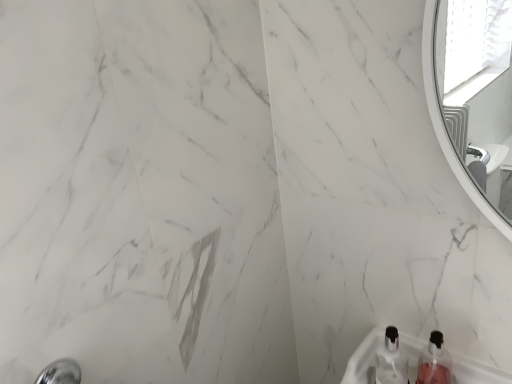
Question: Should I look upward or downward to see pink translucent bottle at lower right, the second bottle when ordered from left to right?

Choices:
 (A) up
 (B) down

Answer: (B)

Question: From the image's perspective, is pink translucent bottle at lower right, the first bottle viewed from the right, located beneath clear plastic bottle at lower center, acting as the 2th bottle starting from the right?

Choices:
 (A) no
 (B) yes

Answer: (B)

Question: Is pink translucent bottle at lower right, the second bottle when ordered from left to right, facing towards clear plastic bottle at lower center, which is the first bottle in left-to-right order?

Choices:
 (A) no
 (B) yes

Answer: (A)

Question: Can you confirm if pink translucent bottle at lower right, the second bottle when ordered from left to right, is shorter than clear plastic bottle at lower center, acting as the 2th bottle starting from the right?

Choices:
 (A) yes
 (B) no

Answer: (A)

Question: Is pink translucent bottle at lower right, the second bottle when ordered from left to right, wider than clear plastic bottle at lower center, acting as the 2th bottle starting from the right?

Choices:
 (A) no
 (B) yes

Answer: (B)

Question: Would you consider pink translucent bottle at lower right, the second bottle when ordered from left to right, to be distant from clear plastic bottle at lower center, acting as the 2th bottle starting from the right?

Choices:
 (A) yes
 (B) no

Answer: (B)

Question: Would you say pink translucent bottle at lower right, the first bottle viewed from the right, is outside clear plastic bottle at lower center, which is the first bottle in left-to-right order?

Choices:
 (A) yes
 (B) no

Answer: (A)

Question: Does clear plastic bottle at lower center, acting as the 2th bottle starting from the right, come behind pink translucent bottle at lower right, the second bottle when ordered from left to right?

Choices:
 (A) no
 (B) yes

Answer: (B)

Question: Is the depth of clear plastic bottle at lower center, which is the first bottle in left-to-right order, less than that of pink translucent bottle at lower right, the first bottle viewed from the right?

Choices:
 (A) yes
 (B) no

Answer: (B)

Question: Is clear plastic bottle at lower center, acting as the 2th bottle starting from the right, outside pink translucent bottle at lower right, the first bottle viewed from the right?

Choices:
 (A) no
 (B) yes

Answer: (B)

Question: From the image's perspective, is clear plastic bottle at lower center, which is the first bottle in left-to-right order, on top of pink translucent bottle at lower right, the second bottle when ordered from left to right?

Choices:
 (A) no
 (B) yes

Answer: (B)

Question: From a real-world perspective, is clear plastic bottle at lower center, which is the first bottle in left-to-right order, beneath pink translucent bottle at lower right, the first bottle viewed from the right?

Choices:
 (A) yes
 (B) no

Answer: (B)

Question: Considering the relative sizes of clear plastic bottle at lower center, which is the first bottle in left-to-right order, and pink translucent bottle at lower right, the first bottle viewed from the right, in the image provided, is clear plastic bottle at lower center, which is the first bottle in left-to-right order, wider than pink translucent bottle at lower right, the first bottle viewed from the right,?

Choices:
 (A) no
 (B) yes

Answer: (A)

Question: Is clear plastic bottle at lower center, which is the first bottle in left-to-right order, taller or shorter than pink translucent bottle at lower right, the first bottle viewed from the right?

Choices:
 (A) short
 (B) tall

Answer: (B)